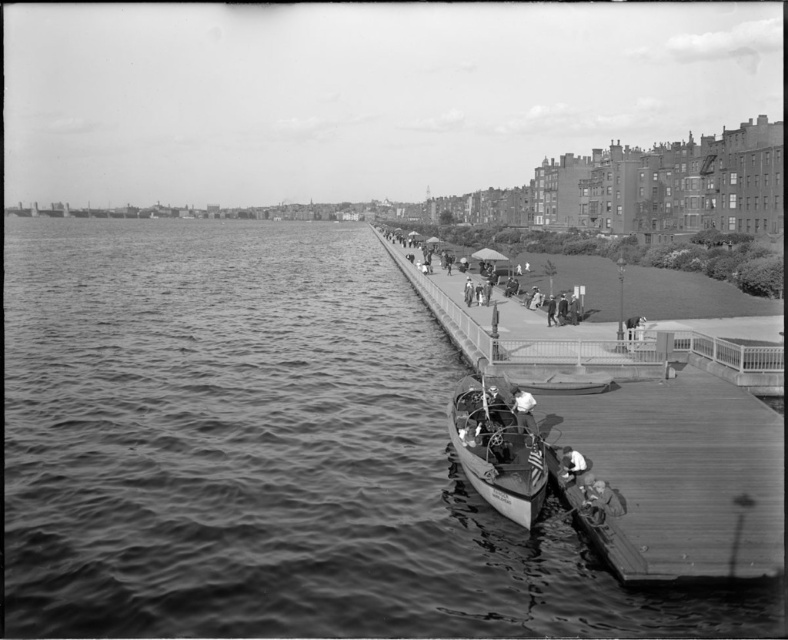
You are standing on the dock and see the wooden boat at lower center and the smooth leather jacket at lower right. Which object is positioned to the left when facing towards the water?

The wooden boat at lower center is positioned to the left of the smooth leather jacket at lower right when facing towards the water.

You are a photographer standing at the waterfront scene. You notice the wooden boat at lower center and the smooth leather jacket at lower right. Which object is positioned higher in the image?

The wooden boat at lower center is positioned higher than the smooth leather jacket at lower right in the image.